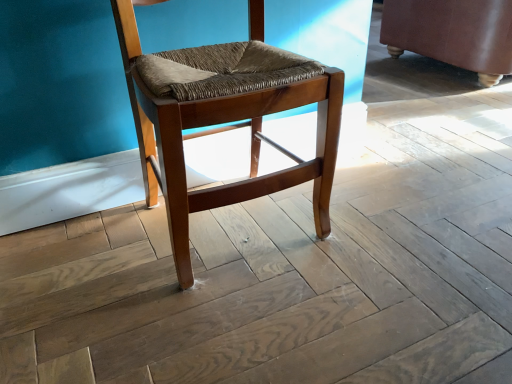
Find the location of `brown leather swivel chair at right`. brown leather swivel chair at right is located at coordinates (453, 33).

What do you see at coordinates (453, 33) in the screenshot?
I see `brown leather swivel chair at right` at bounding box center [453, 33].

The height and width of the screenshot is (384, 512). What do you see at coordinates (222, 123) in the screenshot?
I see `wooden woven seat at center` at bounding box center [222, 123].

You are a GUI agent. You are given a task and a screenshot of the screen. Output one action in this format:
    pyautogui.click(x=<x>, y=<y>)
    Task: Click on the wooden woven seat at center
    
    Given the screenshot: What is the action you would take?
    pyautogui.click(x=222, y=123)

Find the location of a particular element. The height and width of the screenshot is (384, 512). brown leather swivel chair at right is located at coordinates (453, 33).

Consider the image. In the image, is brown leather swivel chair at right on the left side or the right side of wooden woven seat at center?

brown leather swivel chair at right is to the right of wooden woven seat at center.

Based on the photo, who is more distant, brown leather swivel chair at right or wooden woven seat at center?

brown leather swivel chair at right is more distant.

Which is closer to the camera, (400, 14) or (323, 231)?

Positioned in front is point (323, 231).

From the image's perspective, does brown leather swivel chair at right appear lower than wooden woven seat at center?

Actually, brown leather swivel chair at right appears above wooden woven seat at center in the image.

Based on the photo, from a real-world perspective, is brown leather swivel chair at right positioned above or below wooden woven seat at center?

brown leather swivel chair at right is situated lower than wooden woven seat at center in the real world.

Does brown leather swivel chair at right have a lesser width compared to wooden woven seat at center?

No.

Is brown leather swivel chair at right shorter than wooden woven seat at center?

Correct, brown leather swivel chair at right is not as tall as wooden woven seat at center.

Is brown leather swivel chair at right smaller than wooden woven seat at center?

Incorrect, brown leather swivel chair at right is not smaller in size than wooden woven seat at center.

Is wooden woven seat at center a part of brown leather swivel chair at right?

No, wooden woven seat at center is located outside of brown leather swivel chair at right.

Would you say brown leather swivel chair at right is a long distance from wooden woven seat at center?

Yes, brown leather swivel chair at right and wooden woven seat at center are located far from each other.

Is brown leather swivel chair at right aimed at wooden woven seat at center?

No, brown leather swivel chair at right is not turned towards wooden woven seat at center.

How different are the orientations of brown leather swivel chair at right and wooden woven seat at center in degrees?

180 degrees separate the facing orientations of brown leather swivel chair at right and wooden woven seat at center.

Identify the location of chair below the brown leather swivel chair at right (from the image's perspective). This screenshot has height=384, width=512. (222, 123).

Which object is positioned more to the right, wooden woven seat at center or brown leather swivel chair at right?

brown leather swivel chair at right.

Which is in front, wooden woven seat at center or brown leather swivel chair at right?

wooden woven seat at center.

Is point (185, 123) positioned after point (479, 78)?

No, (185, 123) is closer to viewer.

In the scene shown: From the image's perspective, which one is positioned lower, wooden woven seat at center or brown leather swivel chair at right?

From the image's view, wooden woven seat at center is below.

From the picture: From a real-world perspective, relative to brown leather swivel chair at right, is wooden woven seat at center vertically above or below?

wooden woven seat at center is situated higher than brown leather swivel chair at right in the real world.

Considering the sizes of objects wooden woven seat at center and brown leather swivel chair at right in the image provided, who is thinner, wooden woven seat at center or brown leather swivel chair at right?

wooden woven seat at center is thinner.

Does wooden woven seat at center have a lesser height compared to brown leather swivel chair at right?

No.

Between wooden woven seat at center and brown leather swivel chair at right, which one has larger size?

Bigger between the two is brown leather swivel chair at right.

Choose the correct answer: Is wooden woven seat at center inside brown leather swivel chair at right or outside it?

wooden woven seat at center exists outside the volume of brown leather swivel chair at right.

Is wooden woven seat at center placed right next to brown leather swivel chair at right?

No, wooden woven seat at center is not in contact with brown leather swivel chair at right.

Is wooden woven seat at center looking in the opposite direction of brown leather swivel chair at right?

No, wooden woven seat at center is not facing away from brown leather swivel chair at right.

The height and width of the screenshot is (384, 512). I want to click on chair on the left side of brown leather swivel chair at right, so click(x=222, y=123).

Where is `chair on the left of brown leather swivel chair at right`? This screenshot has height=384, width=512. chair on the left of brown leather swivel chair at right is located at coordinates (222, 123).

The height and width of the screenshot is (384, 512). Identify the location of swivel chair that is above the wooden woven seat at center (from the image's perspective). (453, 33).